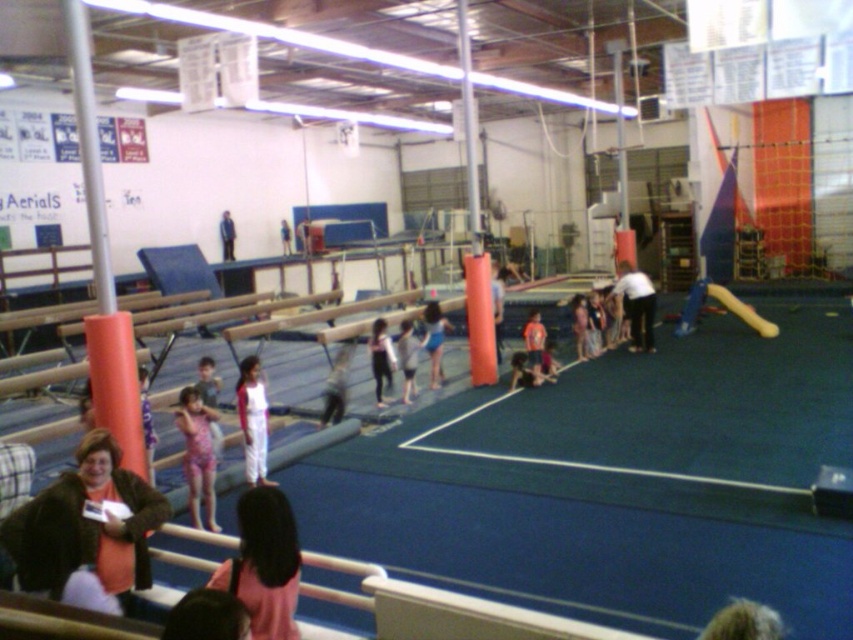
You are a photographer standing at the entrance of the gymnastics facility. You want to take a photo of the white cotton pants at center. Where should you position yourself to capture the pants in the frame?

To capture the white cotton pants at center in the frame, position yourself so that your camera is aligned with the coordinates point (x=252, y=419), which is where the pants are located.

From the picture: You are a gymnast preparing to perform a routine. You notice a matte black jacket at lower left and a white cotton shirt at center in your line of sight. Which clothing item is positioned lower in the scene?

The matte black jacket at lower left is below the white cotton shirt at center, so it is positioned lower in the scene.

You are a photographer standing at the entrance of the gymnastics facility. You need to capture a photo where both the matte black jacket at lower left and the white cotton shirt at center are visible. Based on their heights, which one might appear closer to the bottom of the photo?

The matte black jacket at lower left is shorter than the white cotton shirt at center, so it will appear closer to the bottom of the photo.